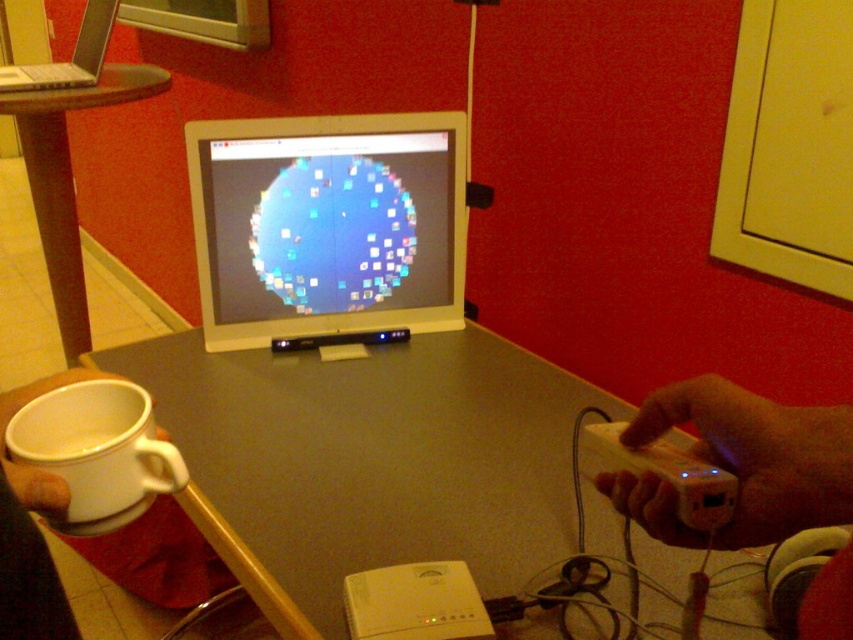
Does point (451, 424) come closer to viewer compared to point (22, 99)?

Yes.

Consider the image. Can you confirm if smooth gray table at center is shorter than brown wooden table at left?

Yes, smooth gray table at center is shorter than brown wooden table at left.

Who is more forward, (560, 509) or (64, 209)?

Point (560, 509) is more forward.

This screenshot has height=640, width=853. I want to click on smooth gray table at center, so click(368, 461).

Between point (351, 140) and point (78, 58), which one is positioned in front?

Point (351, 140) is more forward.

Between point (260, 168) and point (96, 51), which one is positioned in front?

Point (260, 168)

This screenshot has width=853, height=640. Identify the location of white glossy computer monitor at center. (328, 225).

Between white glossy computer monitor at center and wooden remote control at lower right, which one appears on the right side from the viewer's perspective?

wooden remote control at lower right

Does white glossy computer monitor at center have a greater height compared to wooden remote control at lower right?

Correct, white glossy computer monitor at center is much taller as wooden remote control at lower right.

Is point (242, 241) positioned after point (622, 512)?

Yes, point (242, 241) is behind point (622, 512).

Where is `white glossy computer monitor at center`? This screenshot has width=853, height=640. white glossy computer monitor at center is located at coordinates (328, 225).